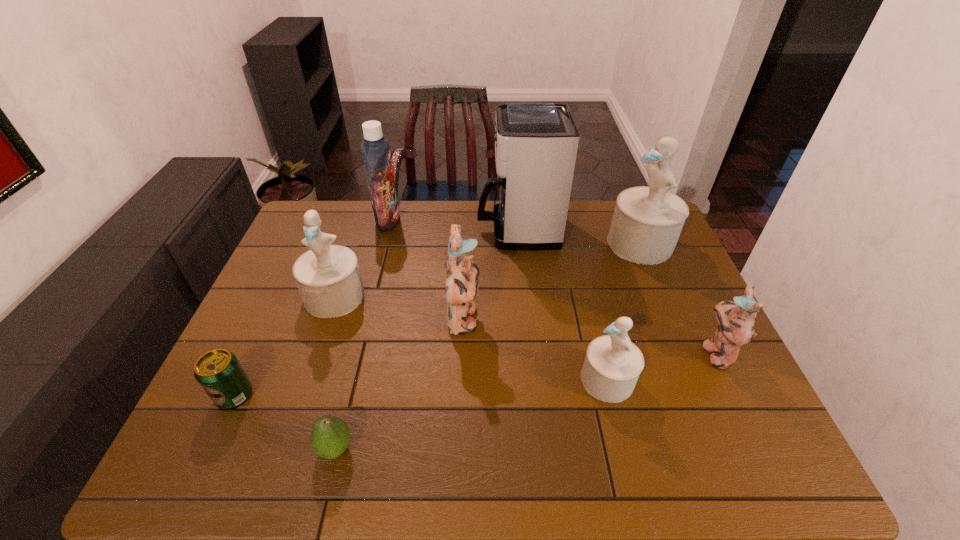
Where is `free spot located 0.230m on the left of the nearest object`? This screenshot has height=540, width=960. free spot located 0.230m on the left of the nearest object is located at coordinates (210, 449).

The width and height of the screenshot is (960, 540). I want to click on coffee maker that is at the far edge, so click(x=536, y=144).

The width and height of the screenshot is (960, 540). Identify the location of figurine that is at the far edge. (647, 221).

This screenshot has width=960, height=540. Find the location of `shampoo located in the far edge section of the desktop`. shampoo located in the far edge section of the desktop is located at coordinates (375, 149).

The width and height of the screenshot is (960, 540). What are the coordinates of `object present at the near edge` in the screenshot? It's located at (330, 436).

You are a GUI agent. You are given a task and a screenshot of the screen. Output one action in this format:
    pyautogui.click(x=<x>, y=<y>)
    Task: Click on the figurine situated at the left edge
    
    Given the screenshot: What is the action you would take?
    pyautogui.click(x=328, y=277)

Where is `beer can present at the left edge`? This screenshot has height=540, width=960. beer can present at the left edge is located at coordinates (220, 374).

Find the location of `object present at the far right corner`. object present at the far right corner is located at coordinates (647, 221).

Where is `vacant space at the far edge of the desktop`? The image size is (960, 540). vacant space at the far edge of the desktop is located at coordinates (426, 213).

Image resolution: width=960 pixels, height=540 pixels. In the image, there is a desktop. Find the location of `blank space at the near edge`. blank space at the near edge is located at coordinates (631, 475).